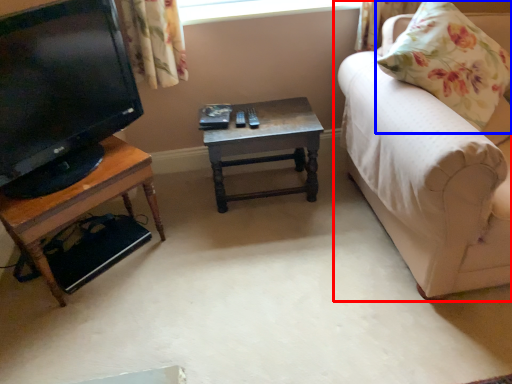
Question: Which of the following is the closest to the observer, studio couch (highlighted by a red box) or pillow (highlighted by a blue box)?

Choices:
 (A) studio couch
 (B) pillow

Answer: (A)